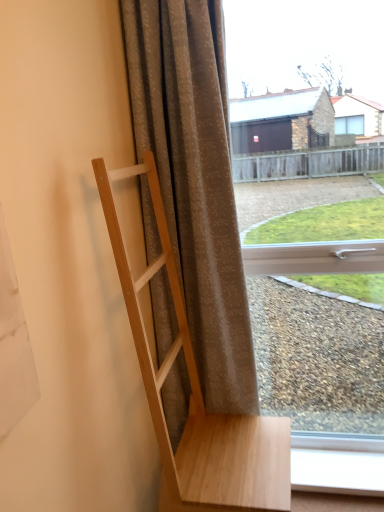
Question: Can you confirm if white plastic window frame at lower right is shorter than transparent glass window at center?

Choices:
 (A) no
 (B) yes

Answer: (B)

Question: Is white plastic window frame at lower right positioned before transparent glass window at center?

Choices:
 (A) yes
 (B) no

Answer: (B)

Question: Does white plastic window frame at lower right have a smaller size compared to transparent glass window at center?

Choices:
 (A) no
 (B) yes

Answer: (B)

Question: Is white plastic window frame at lower right not near transparent glass window at center?

Choices:
 (A) yes
 (B) no

Answer: (A)

Question: Considering the relative sizes of white plastic window frame at lower right and transparent glass window at center in the image provided, is white plastic window frame at lower right bigger than transparent glass window at center?

Choices:
 (A) no
 (B) yes

Answer: (A)

Question: Could you tell me if white plastic window frame at lower right is turned towards transparent glass window at center?

Choices:
 (A) no
 (B) yes

Answer: (A)

Question: Considering the relative sizes of matte gray curtain at center and white plastic window frame at lower right in the image provided, is matte gray curtain at center smaller than white plastic window frame at lower right?

Choices:
 (A) yes
 (B) no

Answer: (B)

Question: Does matte gray curtain at center have a greater height compared to white plastic window frame at lower right?

Choices:
 (A) yes
 (B) no

Answer: (A)

Question: Is matte gray curtain at center looking in the opposite direction of white plastic window frame at lower right?

Choices:
 (A) yes
 (B) no

Answer: (B)

Question: From a real-world perspective, is matte gray curtain at center located beneath white plastic window frame at lower right?

Choices:
 (A) no
 (B) yes

Answer: (A)

Question: Could white plastic window frame at lower right be considered to be inside matte gray curtain at center?

Choices:
 (A) yes
 (B) no

Answer: (B)

Question: Could you tell me if matte gray curtain at center is turned towards white plastic window frame at lower right?

Choices:
 (A) yes
 (B) no

Answer: (B)

Question: Can you confirm if matte gray curtain at center is positioned to the right of transparent glass window at center?

Choices:
 (A) yes
 (B) no

Answer: (B)